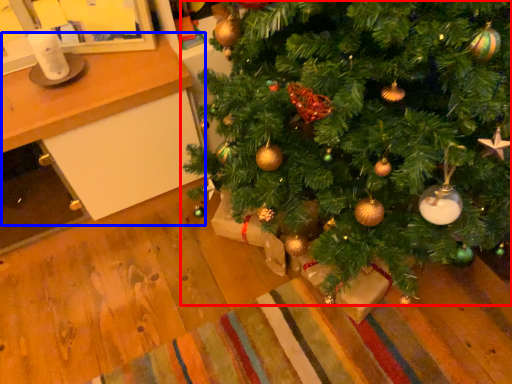
Question: Which object appears farthest to the camera in this image, christmas tree (highlighted by a red box) or table (highlighted by a blue box)?

Choices:
 (A) christmas tree
 (B) table

Answer: (B)